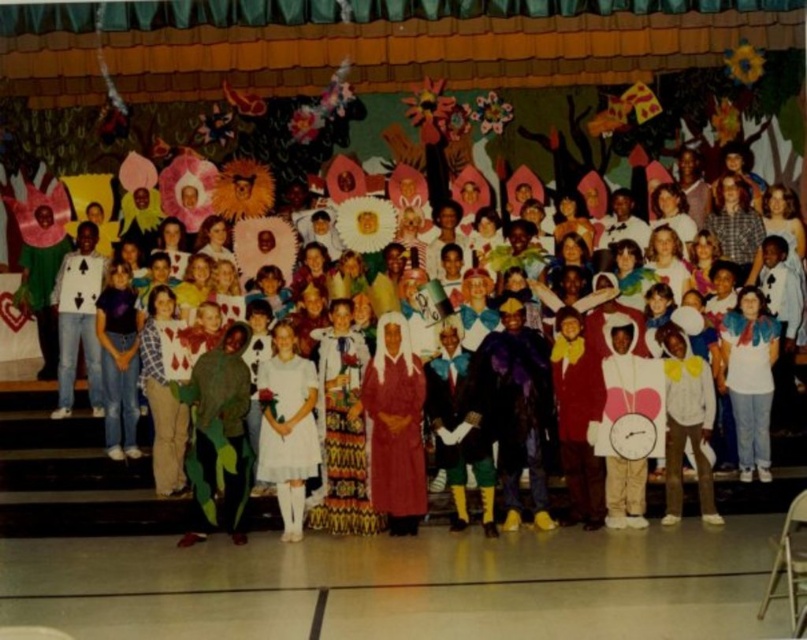
Identify the location of white cotton dress at center. (70, 474).

Can you confirm if white cotton dress at center is positioned to the right of white satin dress at center?

Indeed, white cotton dress at center is positioned on the right side of white satin dress at center.

Which is behind, point (774, 493) or point (276, 342)?

The point (774, 493) is more distant.

Locate an element on the screen. white cotton dress at center is located at coordinates (70, 474).